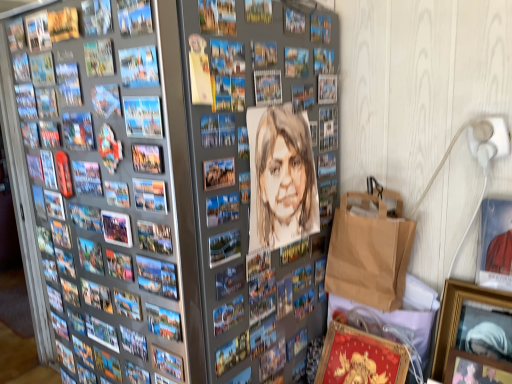
Question: Is blue paper comic book at upper left, placed as the 3th comic book when sorted from right to left, completely or partially outside of wooden picture frame at lower right, placed as the 6th picture frame when sorted from left to right?

Choices:
 (A) yes
 (B) no

Answer: (A)

Question: Can you confirm if blue paper comic book at upper left, the 2th comic book from the top, is wider than wooden picture frame at lower right, which appears as the first picture frame when viewed from the right?

Choices:
 (A) no
 (B) yes

Answer: (A)

Question: Considering the relative sizes of blue paper comic book at upper left, the 3th comic book in the front-to-back sequence, and wooden picture frame at lower right, which appears as the first picture frame when viewed from the right, in the image provided, is blue paper comic book at upper left, the 3th comic book in the front-to-back sequence, taller than wooden picture frame at lower right, which appears as the first picture frame when viewed from the right,?

Choices:
 (A) yes
 (B) no

Answer: (B)

Question: Considering the relative sizes of blue paper comic book at upper left, which is the 2th comic book in back-to-front order, and wooden picture frame at lower right, placed as the 6th picture frame when sorted from left to right, in the image provided, is blue paper comic book at upper left, which is the 2th comic book in back-to-front order, thinner than wooden picture frame at lower right, placed as the 6th picture frame when sorted from left to right,?

Choices:
 (A) yes
 (B) no

Answer: (A)

Question: Can you confirm if blue paper comic book at upper left, which is the third comic book in bottom-to-top order, is bigger than wooden picture frame at lower right, placed as the 6th picture frame when sorted from left to right?

Choices:
 (A) no
 (B) yes

Answer: (A)

Question: Is blue paper comic book at upper left, the 2th comic book from the left, shorter than wooden picture frame at lower right, which appears as the first picture frame when viewed from the right?

Choices:
 (A) no
 (B) yes

Answer: (B)

Question: From a real-world perspective, is metallic silver picture frame at center, which is counted as the fifth picture frame, starting from the right, physically above wooden picture frame at lower right, which appears as the 4th picture frame when viewed from the left?

Choices:
 (A) yes
 (B) no

Answer: (A)

Question: Is metallic silver picture frame at center, which is counted as the fifth picture frame, starting from the right, at the left side of wooden picture frame at lower right, which appears as the 4th picture frame when viewed from the left?

Choices:
 (A) no
 (B) yes

Answer: (B)

Question: From a real-world perspective, is metallic silver picture frame at center, which is counted as the fifth picture frame, starting from the right, physically below wooden picture frame at lower right, which appears as the 4th picture frame when viewed from the left?

Choices:
 (A) yes
 (B) no

Answer: (B)

Question: Is metallic silver picture frame at center, which is counted as the fifth picture frame, starting from the right, in front of wooden picture frame at lower right, which appears as the 4th picture frame when viewed from the left?

Choices:
 (A) no
 (B) yes

Answer: (B)

Question: Is wooden picture frame at lower right, which appears as the 4th picture frame when viewed from the left, located within metallic silver picture frame at center, acting as the 2th picture frame starting from the left?

Choices:
 (A) no
 (B) yes

Answer: (A)

Question: Can you confirm if metallic silver picture frame at center, which is counted as the fifth picture frame, starting from the right, is shorter than wooden picture frame at lower right, which appears as the 4th picture frame when viewed from the left?

Choices:
 (A) no
 (B) yes

Answer: (B)

Question: Can you confirm if matte paper comic book at upper left, which ranks as the third comic book in left-to-right order, is wider than watercolor portrait at center, which is the 4th comic book from left to right?

Choices:
 (A) yes
 (B) no

Answer: (B)